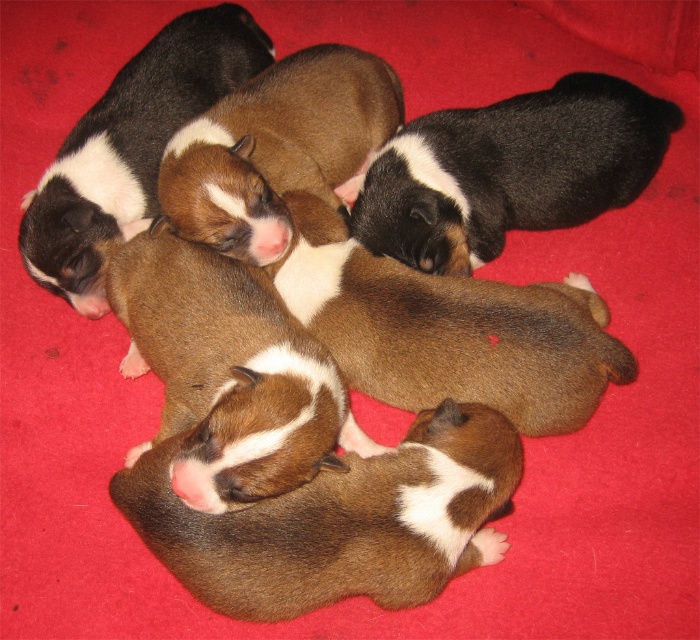
Can you confirm if black fur puppy at upper right is positioned to the right of brown soft fur puppy at center?

Yes, black fur puppy at upper right is to the right of brown soft fur puppy at center.

Does black fur puppy at upper right come behind brown soft fur puppy at center?

Yes, black fur puppy at upper right is further from the viewer.

Find the location of a particular element. The image size is (700, 640). black fur puppy at upper right is located at coordinates (510, 170).

Does brown soft fur puppy at center appear on the left side of brown fur puppy at upper left?

Incorrect, brown soft fur puppy at center is not on the left side of brown fur puppy at upper left.

Consider the image. Which is below, brown soft fur puppy at center or brown fur puppy at upper left?

brown soft fur puppy at center is below.

Image resolution: width=700 pixels, height=640 pixels. Identify the location of brown soft fur puppy at center. (276, 148).

Between brown fuzzy puppy at center and brown soft fur puppy at center, which one is positioned higher?

brown soft fur puppy at center

Does brown fuzzy puppy at center lie behind brown soft fur puppy at center?

No, it is not.

Locate an element on the screen. This screenshot has height=640, width=700. brown fuzzy puppy at center is located at coordinates (449, 330).